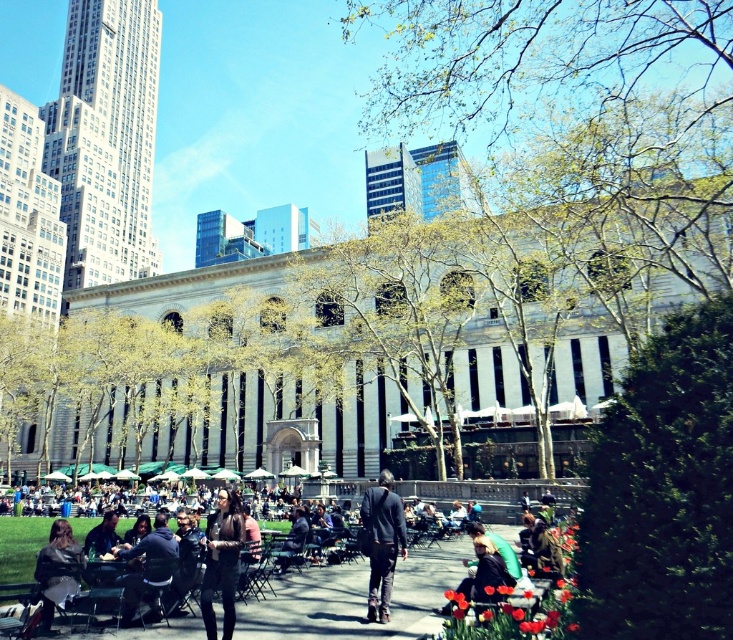
Describe the element at coordinates (353, 596) in the screenshot. I see `dark gray jacket at lower left` at that location.

Can you confirm if dark gray jacket at lower left is positioned below dark brown leather jacket at center?

Indeed, dark gray jacket at lower left is positioned under dark brown leather jacket at center.

Which is behind, point (423, 577) or point (224, 630)?

Positioned behind is point (423, 577).

What are the coordinates of `dark gray jacket at lower left` in the screenshot? It's located at (353, 596).

Who is higher up, dark gray jacket at lower left or dark blue jeans at center?

dark blue jeans at center is above.

Between dark gray jacket at lower left and dark blue jeans at center, which one has more height?

With more height is dark blue jeans at center.

Find the location of `dark gray jacket at lower left`. dark gray jacket at lower left is located at coordinates (353, 596).

Does dark blue jeans at center have a lesser height compared to dark brown leather jacket at center?

Incorrect, dark blue jeans at center's height does not fall short of dark brown leather jacket at center's.

How much distance is there between dark blue jeans at center and dark brown leather jacket at center?

dark blue jeans at center is 7.02 meters away from dark brown leather jacket at center.

Which is in front, point (369, 616) or point (235, 618)?

Point (235, 618)

Identify the location of dark blue jeans at center. The height and width of the screenshot is (640, 733). (380, 541).